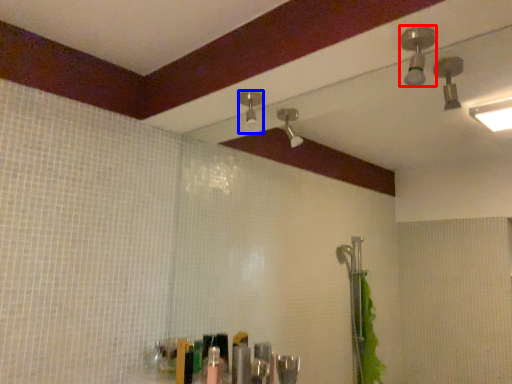
Question: Which point is closer to the camera, shower (highlighted by a red box) or shower (highlighted by a blue box)?

Choices:
 (A) shower
 (B) shower

Answer: (A)